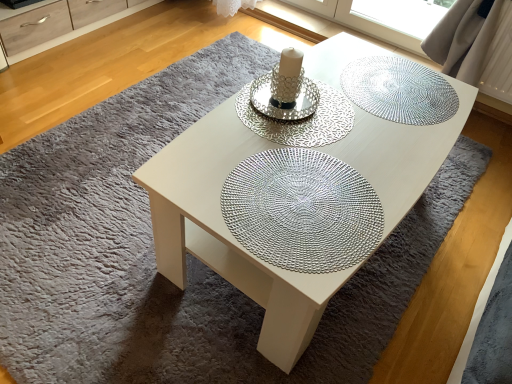
Find the location of `vacant area that lies between metallic silver doily at upper right, positioned as the third glass plate in front-to-back order, and silver metallic doily at center, the 2th glass plate in the back-to-front sequence`. vacant area that lies between metallic silver doily at upper right, positioned as the third glass plate in front-to-back order, and silver metallic doily at center, the 2th glass plate in the back-to-front sequence is located at coordinates (355, 104).